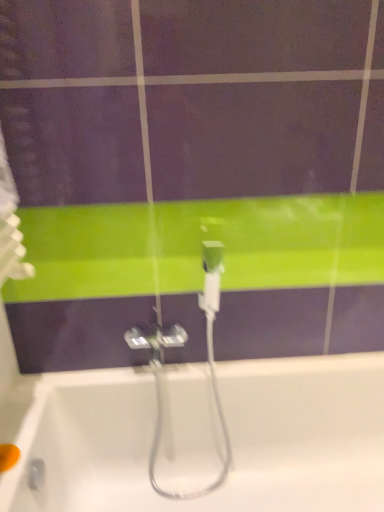
Image resolution: width=384 pixels, height=512 pixels. What are the coordinates of `white glossy bathtub at center` in the screenshot? It's located at pyautogui.click(x=229, y=432).

In order to face white glossy bathtub at center, should I rotate leftwards or rightwards?

A 5.308 degree turn to the right will do.

Describe the element at coordinates (229, 432) in the screenshot. I see `white glossy bathtub at center` at that location.

Where is `white glossy bathtub at center`? The height and width of the screenshot is (512, 384). white glossy bathtub at center is located at coordinates (229, 432).